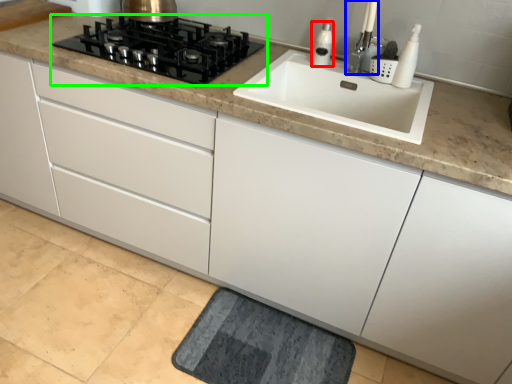
Question: Estimate the real-world distances between objects in this image. Which object is farther from soap dispenser (highlighted by a red box), faucet (highlighted by a blue box) or gas stove (highlighted by a green box)?

Choices:
 (A) faucet
 (B) gas stove

Answer: (B)